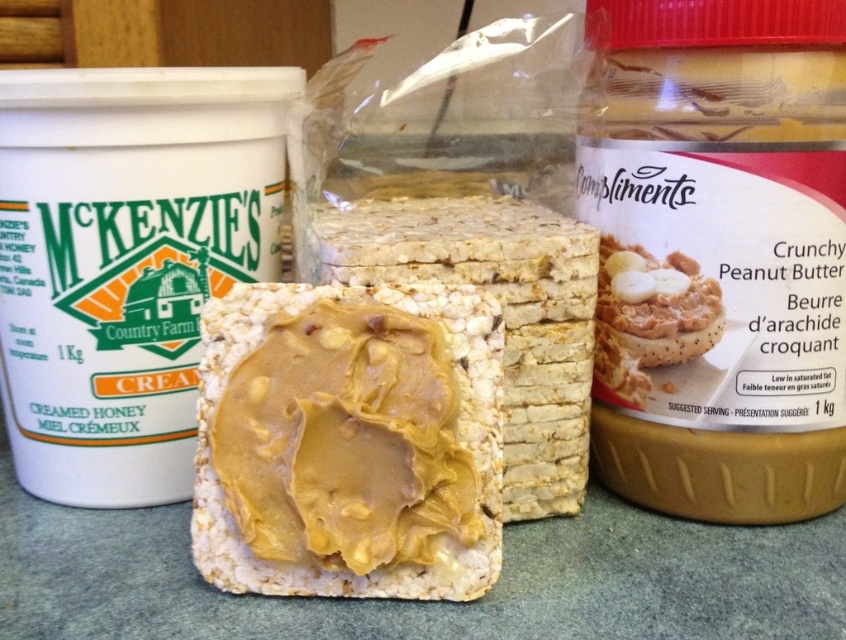
Question: Can you confirm if smooth peanut butter rice cake at center is positioned to the right of crunchy peanut butter spread at upper right?

Choices:
 (A) yes
 (B) no

Answer: (B)

Question: Is smooth peanut butter rice cake at center wider than crunchy peanut butter spread at upper right?

Choices:
 (A) yes
 (B) no

Answer: (A)

Question: Among these points, which one is nearest to the camera?

Choices:
 (A) (610, 273)
 (B) (327, 588)

Answer: (B)

Question: Can you confirm if smooth peanut butter rice cake at center is thinner than crunchy peanut butter spread at upper right?

Choices:
 (A) no
 (B) yes

Answer: (A)

Question: Among these objects, which one is nearest to the camera?

Choices:
 (A) smooth peanut butter rice cake at center
 (B) crunchy peanut butter spread at upper right

Answer: (A)

Question: Which object appears closest to the camera in this image?

Choices:
 (A) smooth peanut butter rice cake at center
 (B) crunchy peanut butter spread at upper right

Answer: (A)